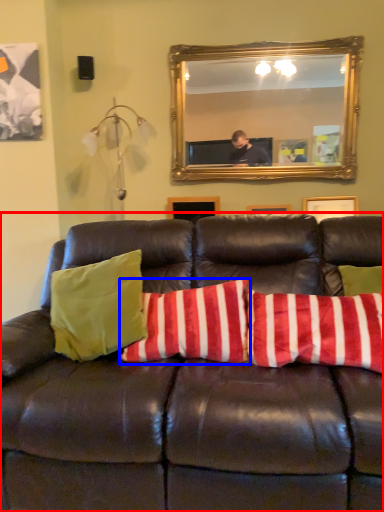
Question: Which point is closer to the camera, studio couch (highlighted by a red box) or pillow (highlighted by a blue box)?

Choices:
 (A) studio couch
 (B) pillow

Answer: (A)